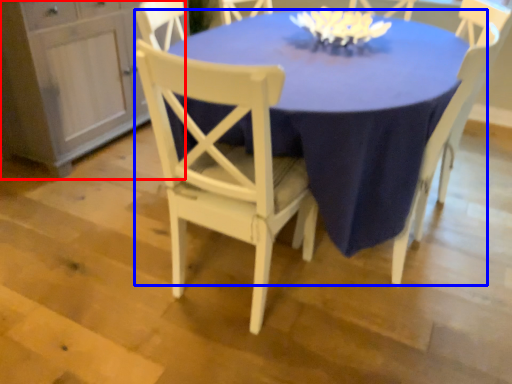
Question: Which object appears closest to the camera in this image, dresser (highlighted by a red box) or table (highlighted by a blue box)?

Choices:
 (A) dresser
 (B) table

Answer: (B)